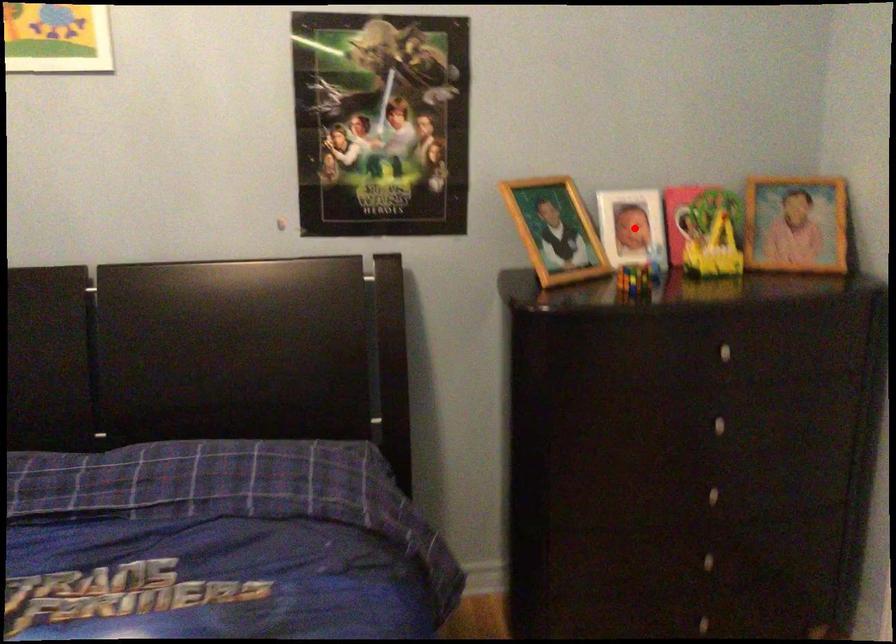
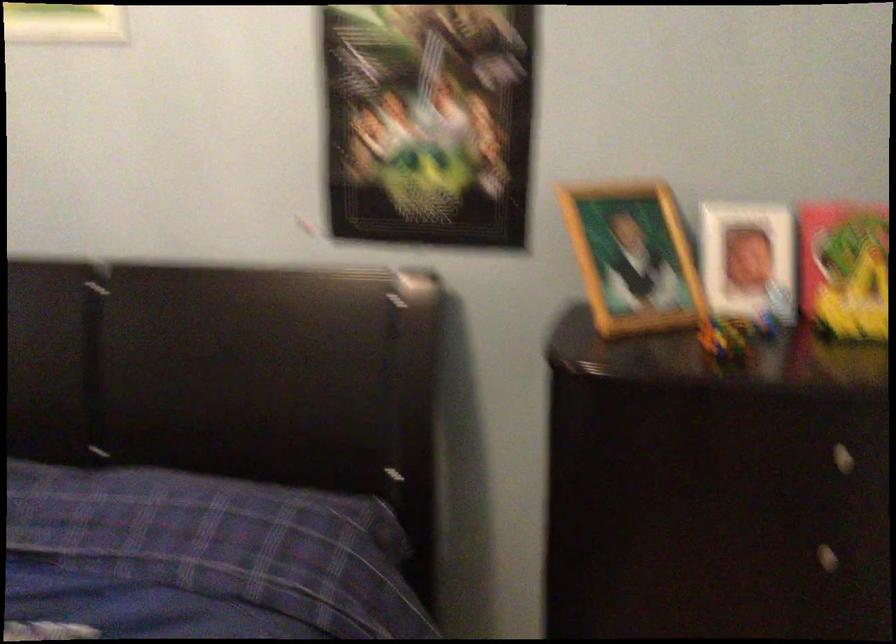
Find the pixel in the second image that matches the highlighted location in the first image.

(748, 261)